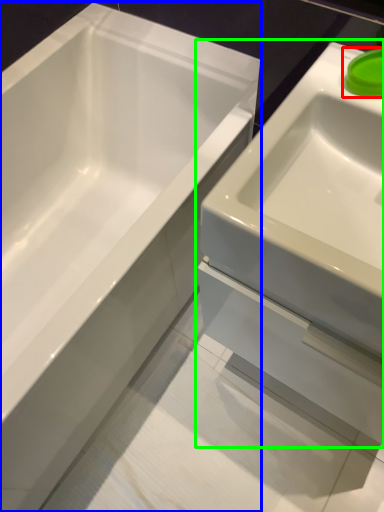
Question: Based on their relative distances, which object is nearer to liquid (highlighted by a red box)? Choose from bathtub (highlighted by a blue box) and sink (highlighted by a green box).

Choices:
 (A) bathtub
 (B) sink

Answer: (B)